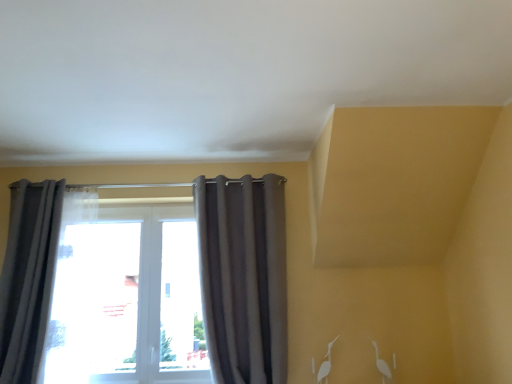
Locate an element on the screen. The width and height of the screenshot is (512, 384). gray fabric curtain at left, which is counted as the 1th curtain, starting from the left is located at coordinates (29, 277).

How much space does gray fabric curtain at left, which is counted as the second curtain, starting from the right, occupy horizontally?

19.45 inches.

The image size is (512, 384). What do you see at coordinates (29, 277) in the screenshot?
I see `gray fabric curtain at left, which is counted as the second curtain, starting from the right` at bounding box center [29, 277].

Locate an element on the screen. The width and height of the screenshot is (512, 384). matte gray curtain at center, arranged as the 1th curtain when viewed from the right is located at coordinates (243, 276).

What do you see at coordinates (243, 276) in the screenshot? I see `matte gray curtain at center, placed as the second curtain when sorted from left to right` at bounding box center [243, 276].

The height and width of the screenshot is (384, 512). Find the location of `gray fabric curtain at left, which is counted as the second curtain, starting from the right`. gray fabric curtain at left, which is counted as the second curtain, starting from the right is located at coordinates (29, 277).

Which object is positioned more to the right, gray fabric curtain at left, which is counted as the second curtain, starting from the right, or matte gray curtain at center, placed as the second curtain when sorted from left to right?

Positioned to the right is matte gray curtain at center, placed as the second curtain when sorted from left to right.

Which object is further away from the camera taking this photo, gray fabric curtain at left, which is counted as the 1th curtain, starting from the left, or matte gray curtain at center, placed as the second curtain when sorted from left to right?

Positioned behind is matte gray curtain at center, placed as the second curtain when sorted from left to right.

Is point (13, 265) positioned in front of point (278, 305)?

Yes, it is in front of point (278, 305).

From the image's perspective, which object appears higher, gray fabric curtain at left, which is counted as the second curtain, starting from the right, or matte gray curtain at center, arranged as the 1th curtain when viewed from the right?

matte gray curtain at center, arranged as the 1th curtain when viewed from the right, from the image's perspective.

From a real-world perspective, is gray fabric curtain at left, which is counted as the 1th curtain, starting from the left, physically above matte gray curtain at center, arranged as the 1th curtain when viewed from the right?

No.

Can you confirm if gray fabric curtain at left, which is counted as the second curtain, starting from the right, is wider than matte gray curtain at center, placed as the second curtain when sorted from left to right?

Yes.

Is gray fabric curtain at left, which is counted as the 1th curtain, starting from the left, taller than matte gray curtain at center, placed as the second curtain when sorted from left to right?

Incorrect, the height of gray fabric curtain at left, which is counted as the 1th curtain, starting from the left, is not larger of that of matte gray curtain at center, placed as the second curtain when sorted from left to right.

In the scene shown: Who is smaller, gray fabric curtain at left, which is counted as the second curtain, starting from the right, or matte gray curtain at center, arranged as the 1th curtain when viewed from the right?

matte gray curtain at center, arranged as the 1th curtain when viewed from the right.

Does gray fabric curtain at left, which is counted as the second curtain, starting from the right, contain matte gray curtain at center, placed as the second curtain when sorted from left to right?

That's incorrect, matte gray curtain at center, placed as the second curtain when sorted from left to right, is not inside gray fabric curtain at left, which is counted as the second curtain, starting from the right.

Is gray fabric curtain at left, which is counted as the second curtain, starting from the right, placed right next to matte gray curtain at center, placed as the second curtain when sorted from left to right?

No, gray fabric curtain at left, which is counted as the second curtain, starting from the right, is not beside matte gray curtain at center, placed as the second curtain when sorted from left to right.

From the picture: Is gray fabric curtain at left, which is counted as the second curtain, starting from the right, oriented away from matte gray curtain at center, arranged as the 1th curtain when viewed from the right?

No, matte gray curtain at center, arranged as the 1th curtain when viewed from the right, is not at the back of gray fabric curtain at left, which is counted as the second curtain, starting from the right.

Image resolution: width=512 pixels, height=384 pixels. I want to click on curtain below the matte gray curtain at center, arranged as the 1th curtain when viewed from the right (from a real-world perspective), so click(29, 277).

In the scene shown: Visually, is matte gray curtain at center, arranged as the 1th curtain when viewed from the right, positioned to the left or to the right of gray fabric curtain at left, which is counted as the second curtain, starting from the right?

matte gray curtain at center, arranged as the 1th curtain when viewed from the right, is to the right of gray fabric curtain at left, which is counted as the second curtain, starting from the right.

Relative to gray fabric curtain at left, which is counted as the second curtain, starting from the right, is matte gray curtain at center, arranged as the 1th curtain when viewed from the right, in front or behind?

matte gray curtain at center, arranged as the 1th curtain when viewed from the right, is behind gray fabric curtain at left, which is counted as the second curtain, starting from the right.

Is point (252, 341) closer or farther from the camera than point (10, 210)?

Clearly, point (252, 341) is closer to the camera than point (10, 210).

From the image's perspective, is matte gray curtain at center, placed as the second curtain when sorted from left to right, above or below gray fabric curtain at left, which is counted as the 1th curtain, starting from the left?

Based on their image positions, matte gray curtain at center, placed as the second curtain when sorted from left to right, is located above gray fabric curtain at left, which is counted as the 1th curtain, starting from the left.

From a real-world perspective, is matte gray curtain at center, arranged as the 1th curtain when viewed from the right, positioned above or below gray fabric curtain at left, which is counted as the second curtain, starting from the right?

Clearly, from a real-world perspective, matte gray curtain at center, arranged as the 1th curtain when viewed from the right, is above gray fabric curtain at left, which is counted as the second curtain, starting from the right.

Which of these two, matte gray curtain at center, placed as the second curtain when sorted from left to right, or gray fabric curtain at left, which is counted as the 1th curtain, starting from the left, is wider?

gray fabric curtain at left, which is counted as the 1th curtain, starting from the left.

Between matte gray curtain at center, placed as the second curtain when sorted from left to right, and gray fabric curtain at left, which is counted as the 1th curtain, starting from the left, which one has more height?

Standing taller between the two is matte gray curtain at center, placed as the second curtain when sorted from left to right.

Considering the sizes of objects matte gray curtain at center, arranged as the 1th curtain when viewed from the right, and gray fabric curtain at left, which is counted as the second curtain, starting from the right, in the image provided, who is bigger, matte gray curtain at center, arranged as the 1th curtain when viewed from the right, or gray fabric curtain at left, which is counted as the second curtain, starting from the right,?

gray fabric curtain at left, which is counted as the second curtain, starting from the right, is bigger.

Is matte gray curtain at center, arranged as the 1th curtain when viewed from the right, positioned beyond the bounds of gray fabric curtain at left, which is counted as the 1th curtain, starting from the left?

Yes, matte gray curtain at center, arranged as the 1th curtain when viewed from the right, is not within gray fabric curtain at left, which is counted as the 1th curtain, starting from the left.

Is matte gray curtain at center, arranged as the 1th curtain when viewed from the right, in contact with gray fabric curtain at left, which is counted as the 1th curtain, starting from the left?

matte gray curtain at center, arranged as the 1th curtain when viewed from the right, and gray fabric curtain at left, which is counted as the 1th curtain, starting from the left, are not in contact.

Is matte gray curtain at center, arranged as the 1th curtain when viewed from the right, looking in the opposite direction of gray fabric curtain at left, which is counted as the second curtain, starting from the right?

No, gray fabric curtain at left, which is counted as the second curtain, starting from the right, is not at the back of matte gray curtain at center, arranged as the 1th curtain when viewed from the right.

Identify the location of curtain beneath the matte gray curtain at center, arranged as the 1th curtain when viewed from the right (from a real-world perspective). The width and height of the screenshot is (512, 384). (29, 277).

The height and width of the screenshot is (384, 512). What are the coordinates of `curtain in front of the matte gray curtain at center, placed as the second curtain when sorted from left to right` in the screenshot? It's located at (29, 277).

At what (x,y) coordinates should I click in order to perform the action: click on curtain on the left of matte gray curtain at center, arranged as the 1th curtain when viewed from the right. Please return your answer as a coordinate pair (x, y). The height and width of the screenshot is (384, 512). Looking at the image, I should click on (29, 277).